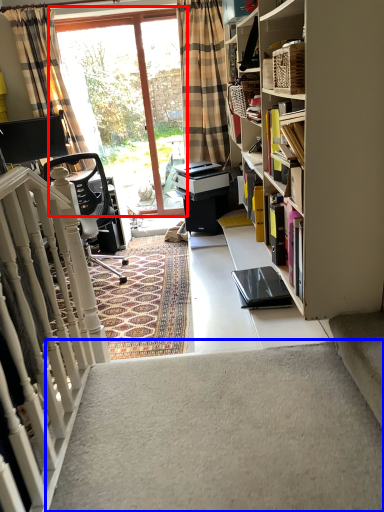
Question: Among these objects, which one is nearest to the camera, window (highlighted by a red box) or stairwell (highlighted by a blue box)?

Choices:
 (A) window
 (B) stairwell

Answer: (B)